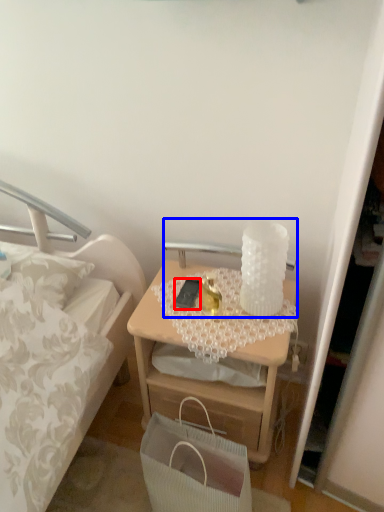
Question: Which object appears closest to the camera in this image, mobile phone (highlighted by a red box) or table lamp (highlighted by a blue box)?

Choices:
 (A) mobile phone
 (B) table lamp

Answer: (A)